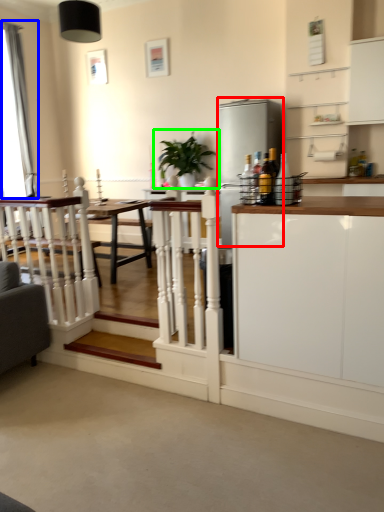
Question: Based on their relative distances, which object is farther from appliance (highlighted by a red box)? Choose from curtain (highlighted by a blue box) and houseplant (highlighted by a green box).

Choices:
 (A) curtain
 (B) houseplant

Answer: (A)